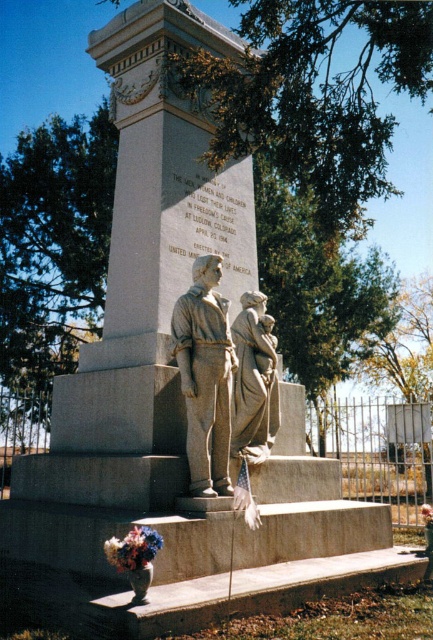
Who is higher up, matte gray stone sculpture at center or fluffy bouquet at lower left?

matte gray stone sculpture at center

Between point (249, 406) and point (139, 534), which one is positioned behind?

The point (249, 406) is more distant.

Find the location of a particular element. The height and width of the screenshot is (640, 433). matte gray stone sculpture at center is located at coordinates (254, 381).

This screenshot has height=640, width=433. I want to click on matte gray stone sculpture at center, so click(x=254, y=381).

Does gray stone statue at center have a greater width compared to matte gray stone sculpture at center?

Yes, gray stone statue at center is wider than matte gray stone sculpture at center.

In the scene shown: Is gray stone statue at center further to camera compared to matte gray stone sculpture at center?

That is False.

Measure the distance between point (213,385) and camera.

The distance of point (213,385) from camera is 12.82 meters.

Where is `gray stone statue at center`? This screenshot has width=433, height=640. gray stone statue at center is located at coordinates (204, 376).

Can you confirm if fluffy bouquet at lower left is bigger than fluffy bouquet at lower center?

No, fluffy bouquet at lower left is not bigger than fluffy bouquet at lower center.

Is fluffy bouquet at lower left shorter than fluffy bouquet at lower center?

Indeed, fluffy bouquet at lower left has a lesser height compared to fluffy bouquet at lower center.

Between point (133, 541) and point (430, 515), which one is positioned behind?

Positioned behind is point (430, 515).

This screenshot has height=640, width=433. What are the coordinates of `fluffy bouquet at lower left` in the screenshot? It's located at (132, 548).